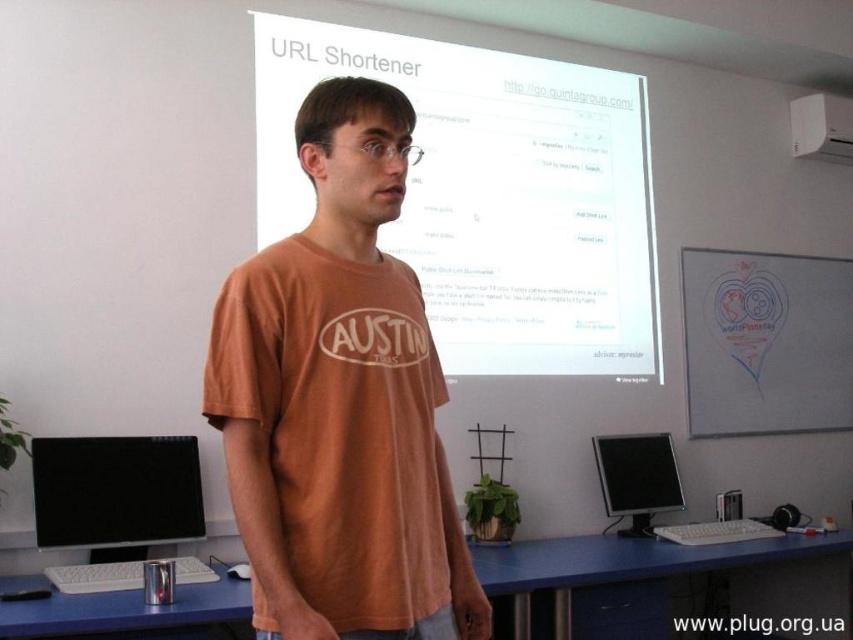
Question: Can you confirm if orange cotton t-shirt at center is positioned to the right of white glossy projector screen at upper center?

Choices:
 (A) yes
 (B) no

Answer: (B)

Question: Does orange cotton t-shirt at center appear on the right side of black glossy monitor at lower left?

Choices:
 (A) no
 (B) yes

Answer: (B)

Question: Which of the following is the closest to the observer?

Choices:
 (A) (379, 608)
 (B) (635, 490)
 (C) (688, 250)
 (D) (62, 525)

Answer: (A)

Question: Considering the real-world distances, which object is farthest from the whiteboard at upper right?

Choices:
 (A) orange cotton t-shirt at center
 (B) white plastic projector at upper right

Answer: (A)

Question: Is black glossy monitor at lower left positioned behind white plastic projector at upper right?

Choices:
 (A) no
 (B) yes

Answer: (A)

Question: Which object is positioned farthest from the black glossy monitor at lower left?

Choices:
 (A) orange cotton t-shirt at center
 (B) white plastic projector at upper right

Answer: (B)